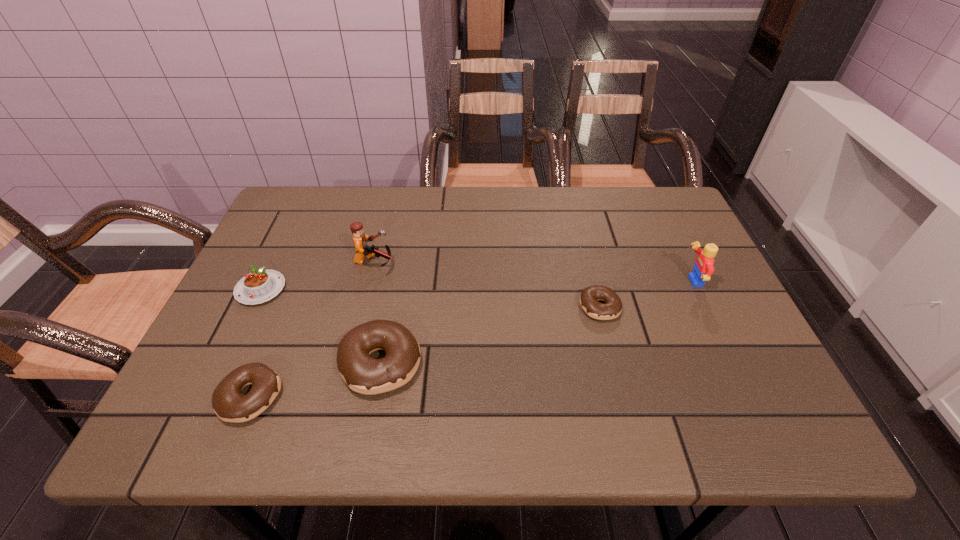
Locate an element on the screen. The height and width of the screenshot is (540, 960). vacant area that satisfies the following two spatial constraints: 1. holding a crossbow in the hands of the left Lego; 2. on the right side of the shortest object is located at coordinates (363, 307).

Find the location of a particular element. The height and width of the screenshot is (540, 960). free space that satisfies the following two spatial constraints: 1. holding a crossbow in the hands of the left Lego; 2. on the left side of the fourth shortest object is located at coordinates (349, 363).

Image resolution: width=960 pixels, height=540 pixels. What are the coordinates of `vacant space that satisfies the following two spatial constraints: 1. holding a crossbow in the hands of the left Lego; 2. on the back side of the shortest doughnut` in the screenshot? It's located at (363, 307).

Identify the location of free space that satisfies the following two spatial constraints: 1. on the back side of the third tallest object; 2. holding a crossbow in the hands of the left Lego. (399, 262).

Locate an element on the screen. free location that satisfies the following two spatial constraints: 1. on the back side of the shortest object; 2. holding a crossbow in the hands of the left Lego is located at coordinates (588, 262).